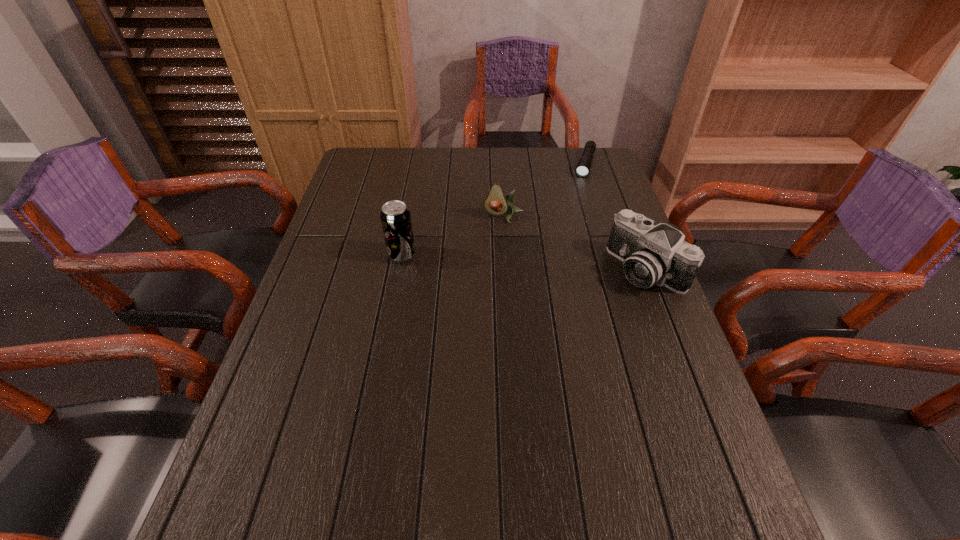
Find the location of `free space at the right edge`. free space at the right edge is located at coordinates (598, 255).

Identify the location of vacant space at the far left corner. Image resolution: width=960 pixels, height=540 pixels. (356, 176).

Locate an element on the screen. vacant area that lies between the flashlight and the third nearest object is located at coordinates (544, 191).

What are the coordinates of `free area in between the third nearest object and the flashlight` in the screenshot? It's located at (544, 191).

Locate an element on the screen. free space that is in between the leftmost object and the avocado is located at coordinates (452, 235).

The image size is (960, 540). Find the location of `vacant area that lies between the avocado and the flashlight`. vacant area that lies between the avocado and the flashlight is located at coordinates (544, 191).

You are a GUI agent. You are given a task and a screenshot of the screen. Output one action in this format:
    pyautogui.click(x=<x>, y=<y>)
    Task: Click on the vacant space that is in between the soda can and the camera
    This screenshot has width=960, height=540.
    Given the screenshot: What is the action you would take?
    pyautogui.click(x=524, y=262)

This screenshot has width=960, height=540. In order to click on free space between the third tallest object and the farthest object in this screenshot , I will do `click(544, 191)`.

The height and width of the screenshot is (540, 960). I want to click on free space between the third tallest object and the camera, so click(575, 243).

Identify the location of the third closest object relative to the soda can. click(x=583, y=167).